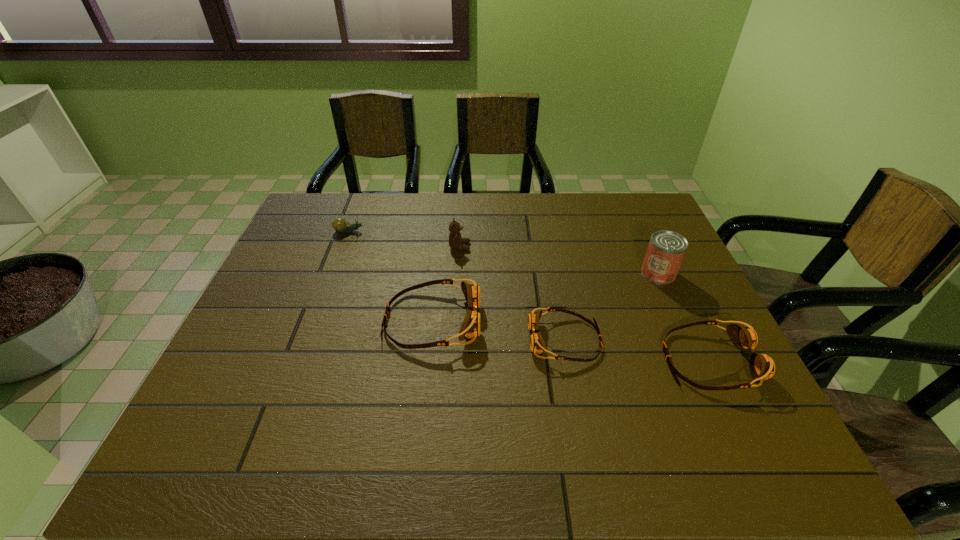
In the image, there is a desktop. Identify the location of vacant space at the near left corner. 225,416.

Where is `vacant region at the far right corner`? The width and height of the screenshot is (960, 540). vacant region at the far right corner is located at coordinates (x=616, y=197).

The image size is (960, 540). Identify the location of vacant space at the near right corner of the desktop. (741, 417).

I want to click on free space that is in between the escargot and the second goggles from left to right, so click(x=457, y=285).

Locate an element on the screen. empty location between the teddy bear and the shortest goggles is located at coordinates (513, 293).

Find the location of a particular element. This screenshot has height=540, width=960. vacant space that is in between the leftmost object and the leftmost goggles is located at coordinates (391, 275).

In order to click on free point between the escargot and the fourth nearest object in this screenshot , I will do pos(504,252).

Identify the location of blank region between the third shortest object and the leftmost goggles. (571, 340).

The width and height of the screenshot is (960, 540). Identify the location of free space between the leftmost goggles and the third shortest object. (571, 340).

This screenshot has width=960, height=540. What are the coordinates of `vacant area between the second shortest goggles and the fourth nearest object` in the screenshot? It's located at (684, 317).